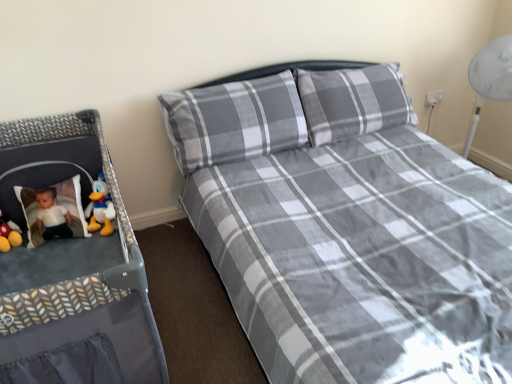
What is the approximate height of gray plaid bed at center?

It is 34.39 inches.

Describe the element at coordinates (347, 237) in the screenshot. I see `gray plaid bed at center` at that location.

Locate an element on the screen. Image resolution: width=512 pixels, height=384 pixels. gray plaid bed at center is located at coordinates (347, 237).

From a real-world perspective, between gray plaid pillow at center and matte yellow duck at left, who is vertically higher?

gray plaid pillow at center is physically above.

Identify the location of pillow that appears above the matte yellow duck at left (from a real-world perspective). The height and width of the screenshot is (384, 512). (234, 121).

Is gray plaid pillow at center positioned beyond the bounds of matte yellow duck at left?

Indeed, gray plaid pillow at center is completely outside matte yellow duck at left.

Considering the relative positions of gray plaid pillow at center and matte yellow duck at left in the image provided, is gray plaid pillow at center to the left or to the right of matte yellow duck at left?

gray plaid pillow at center is positioned on matte yellow duck at left's right side.

In terms of height, does gray plaid bed at center look taller or shorter compared to gray plaid pillow at center?

gray plaid bed at center is taller than gray plaid pillow at center.

From the image's perspective, which one is positioned higher, gray plaid bed at center or gray plaid pillow at center?

gray plaid pillow at center, from the image's perspective.

Based on the photo, is gray plaid bed at center oriented towards gray plaid pillow at center?

No, gray plaid bed at center is not turned towards gray plaid pillow at center.

Can you tell me how much matte yellow duck at left and gray plaid pillow at center differ in facing direction?

There is a 3.06-degree angle between the facing directions of matte yellow duck at left and gray plaid pillow at center.

Does matte yellow duck at left have a smaller size compared to gray plaid pillow at center?

Indeed, matte yellow duck at left has a smaller size compared to gray plaid pillow at center.

Are matte yellow duck at left and gray plaid pillow at center making contact?

There is a gap between matte yellow duck at left and gray plaid pillow at center.

In the scene shown: From the image's perspective, which is below, gray plaid pillow at center or gray plaid bed at center?

gray plaid bed at center is shown below in the image.

Locate an element on the screen. bed that appears below the gray plaid pillow at center (from a real-world perspective) is located at coordinates (347, 237).

From a real-world perspective, which object rests below the other?

gray plaid bed at center is physically lower.

Image resolution: width=512 pixels, height=384 pixels. In the image, there is a matte yellow duck at left. What are the coordinates of `bed below it (from the image's perspective)` in the screenshot? It's located at (347, 237).

Can we say matte yellow duck at left lies outside gray plaid bed at center?

Indeed, matte yellow duck at left is completely outside gray plaid bed at center.

From the image's perspective, would you say matte yellow duck at left is positioned over gray plaid bed at center?

Yes, from the image's perspective, matte yellow duck at left is over gray plaid bed at center.

Considering the positions of points (95, 225) and (364, 71), is point (95, 225) closer to camera compared to point (364, 71)?

Yes.

Does point (310, 192) appear closer or farther from the camera than point (94, 224)?

Point (310, 192) is positioned closer to the camera compared to point (94, 224).

You are a GUI agent. You are given a task and a screenshot of the screen. Output one action in this format:
    pyautogui.click(x=<x>, y=<y>)
    Task: Click on the toy lying above the gray plaid bed at center (from the image's perspective)
    
    Given the screenshot: What is the action you would take?
    pyautogui.click(x=101, y=208)

What's the angular difference between gray plaid bed at center and matte yellow duck at left's facing directions?

The facing directions of gray plaid bed at center and matte yellow duck at left are 0.573 degrees apart.

From the image's perspective, which one is positioned higher, gray plaid bed at center or matte yellow duck at left?

matte yellow duck at left appears higher in the image.

Locate an element on the screen. The height and width of the screenshot is (384, 512). toy that appears below the gray plaid pillow at center (from the image's perspective) is located at coordinates (101, 208).

This screenshot has width=512, height=384. What are the coordinates of `bed in front of the gray plaid pillow at center` in the screenshot? It's located at (347, 237).

Based on their spatial positions, is gray plaid pillow at center or matte yellow duck at left further from gray plaid bed at center?

matte yellow duck at left is positioned further to the anchor gray plaid bed at center.

Considering their positions, is gray plaid pillow at center positioned further to matte yellow duck at left than gray plaid bed at center?

Based on the image, gray plaid bed at center appears to be further to matte yellow duck at left.

Estimate the real-world distances between objects in this image. Which object is closer to gray plaid bed at center, matte yellow duck at left or gray plaid pillow at center?

gray plaid pillow at center is positioned closer to the anchor gray plaid bed at center.

Estimate the real-world distances between objects in this image. Which object is closer to matte yellow duck at left, gray plaid bed at center or gray plaid pillow at center?

Based on the image, gray plaid pillow at center appears to be nearer to matte yellow duck at left.

Looking at the image, which one is located closer to gray plaid pillow at center, gray plaid bed at center or matte yellow duck at left?

Based on the image, gray plaid bed at center appears to be nearer to gray plaid pillow at center.

When comparing their distances from gray plaid pillow at center, does matte yellow duck at left or gray plaid bed at center seem closer?

The object closer to gray plaid pillow at center is gray plaid bed at center.

Locate an element on the screen. pillow between gray plaid bed at center and matte yellow duck at left from front to back is located at coordinates (234, 121).